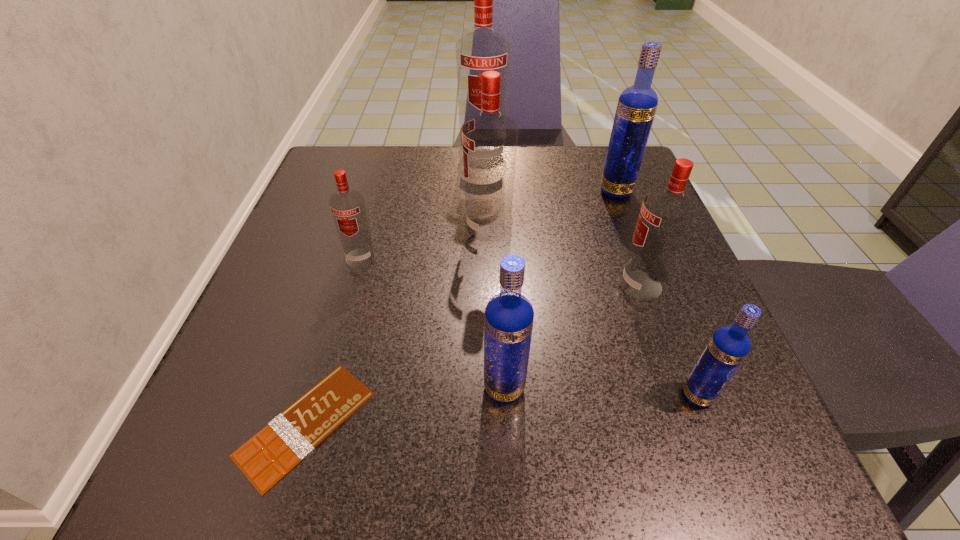
In order to click on the leftmost vodka in this screenshot , I will do [348, 209].

Locate an element on the screen. The width and height of the screenshot is (960, 540). the fifth nearest object is located at coordinates (348, 209).

Locate an element on the screen. the shortest object is located at coordinates (267, 457).

Find the location of a particular element. free region located on the front label of the biggest red vodka is located at coordinates (483, 211).

The width and height of the screenshot is (960, 540). What are the coordinates of `free space located 0.110m on the left of the biggest blue vodka` in the screenshot? It's located at (549, 191).

Locate an element on the screen. This screenshot has width=960, height=540. vacant area situated 0.330m on the front label of the third farthest vodka is located at coordinates (298, 230).

This screenshot has width=960, height=540. Find the location of `blank space located on the front label of the third farthest vodka`. blank space located on the front label of the third farthest vodka is located at coordinates (424, 230).

You are a GUI agent. You are given a task and a screenshot of the screen. Output one action in this format:
    pyautogui.click(x=<x>, y=<y>)
    Task: Click on the vacant space located on the front label of the third farthest vodka
    The width and height of the screenshot is (960, 540).
    Given the screenshot: What is the action you would take?
    pyautogui.click(x=328, y=230)

Identify the location of vacant position located 0.180m on the left of the leftmost blue vodka. (356, 388).

Image resolution: width=960 pixels, height=540 pixels. What are the coordinates of `free space located on the front label of the second smallest red vodka` in the screenshot? It's located at (422, 285).